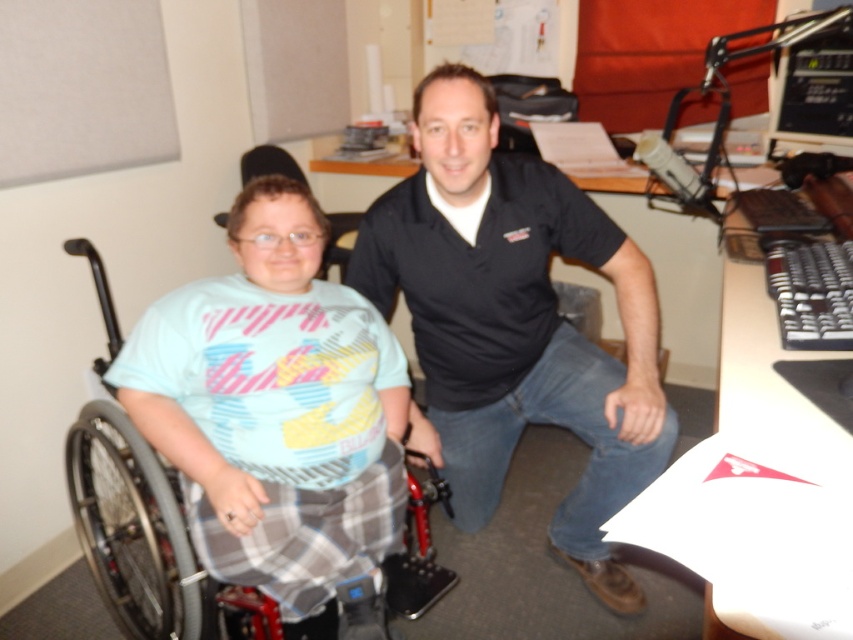
You are an office assistant who needs to move a new desk into the office. The desk is as wide as the metallic gray wheelchair at left. Will the desk fit through the doorway, which is the same width as the black plastic monitor at upper right?

The metallic gray wheelchair at left is larger than the black plastic monitor at upper right. Since the desk is as wide as the wheelchair, it will not fit through the doorway, which is the same width as the monitor.

You are a photographer trying to capture a clear photo of both the black cotton shirt at center and the metallic gray wheelchair at left. Which object should you focus on first to ensure it appears sharp in the photo?

The black cotton shirt at center should be focused on first because it is closer to the viewer than the metallic gray wheelchair at left, ensuring it will be sharp in the photo.

You are trying to decide which item to move first to clear space on the desk. Based on their sizes, which item takes up more desk space between the black cotton shirt at center and the black plastic monitor at upper right?

The black cotton shirt at center is larger in size than the black plastic monitor at upper right, so it takes up more desk space.